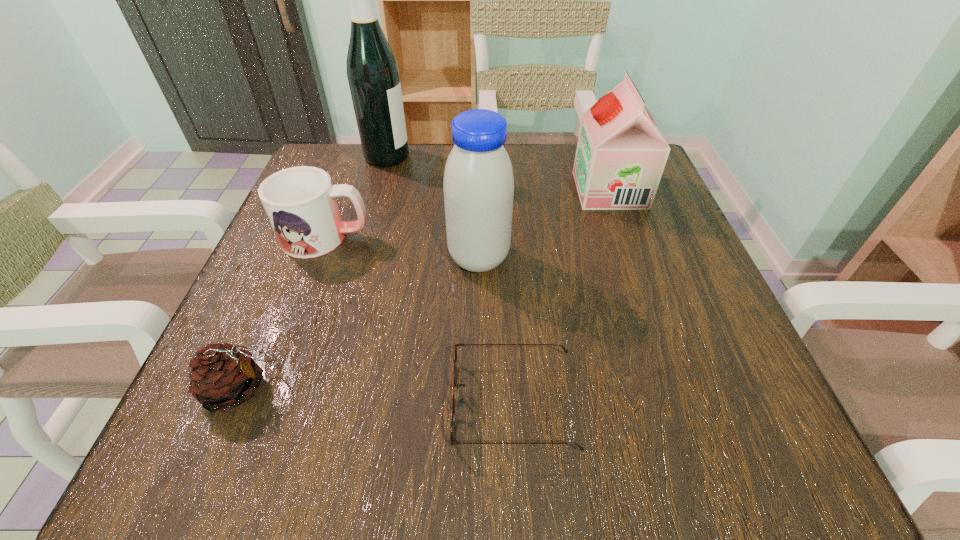
In the image, there is a desktop. Where is `vacant space at the far edge`? vacant space at the far edge is located at coordinates (410, 198).

This screenshot has height=540, width=960. I want to click on free space at the near edge of the desktop, so click(380, 461).

This screenshot has height=540, width=960. I want to click on free spot at the right edge of the desktop, so click(714, 299).

Where is `vacant space at the near right corner of the desktop`? The width and height of the screenshot is (960, 540). vacant space at the near right corner of the desktop is located at coordinates (740, 417).

Where is `free point between the shortest object and the mug`? free point between the shortest object and the mug is located at coordinates (420, 320).

Locate an element on the screen. Image resolution: width=960 pixels, height=540 pixels. unoccupied area between the sunglasses and the taller soya milk is located at coordinates (496, 330).

Where is `free space between the pinecone and the sunglasses`? This screenshot has width=960, height=540. free space between the pinecone and the sunglasses is located at coordinates (377, 396).

The height and width of the screenshot is (540, 960). I want to click on empty space that is in between the third shortest object and the second shortest object, so click(284, 313).

The width and height of the screenshot is (960, 540). I want to click on free space between the third shortest object and the shortest object, so click(420, 320).

At what (x,y) coordinates should I click in order to perform the action: click on free space between the sunglasses and the third shortest object. Please return your answer as a coordinate pair (x, y). Looking at the image, I should click on (420, 320).